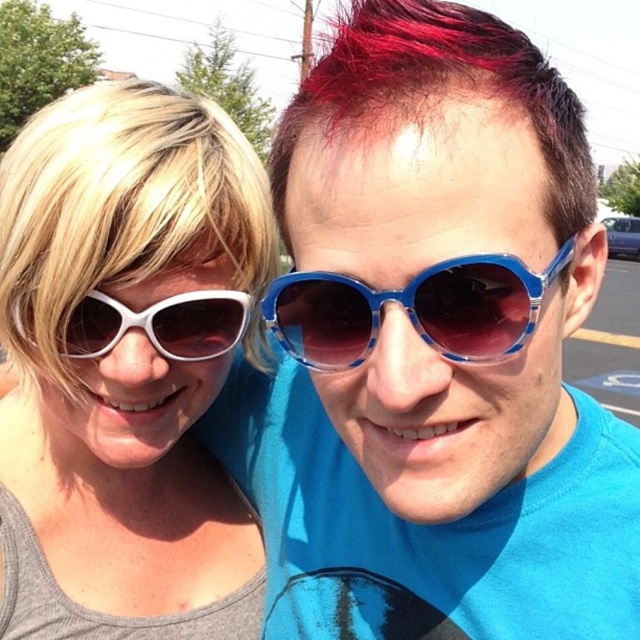
Question: Is white plastic sunglasses at upper left positioned in front of shiny red hair at upper center?

Choices:
 (A) no
 (B) yes

Answer: (A)

Question: Which point is closer to the camera taking this photo?

Choices:
 (A) (212, 332)
 (B) (131, 180)
 (C) (312, 278)
 (D) (280, 216)

Answer: (C)

Question: Observing the image, what is the correct spatial positioning of blue acetate sunglasses at center in reference to white plastic sunglasses at left?

Choices:
 (A) left
 (B) right

Answer: (B)

Question: Among these objects, which one is farthest from the camera?

Choices:
 (A) white plastic sunglasses at upper left
 (B) white plastic sunglasses at left

Answer: (B)

Question: Considering the real-world distances, which object is closest to the shiny red hair at upper center?

Choices:
 (A) white plastic sunglasses at upper left
 (B) white plastic sunglasses at left
 (C) blue acetate sunglasses at center

Answer: (C)

Question: Is shiny red hair at upper center thinner than white plastic sunglasses at left?

Choices:
 (A) no
 (B) yes

Answer: (A)